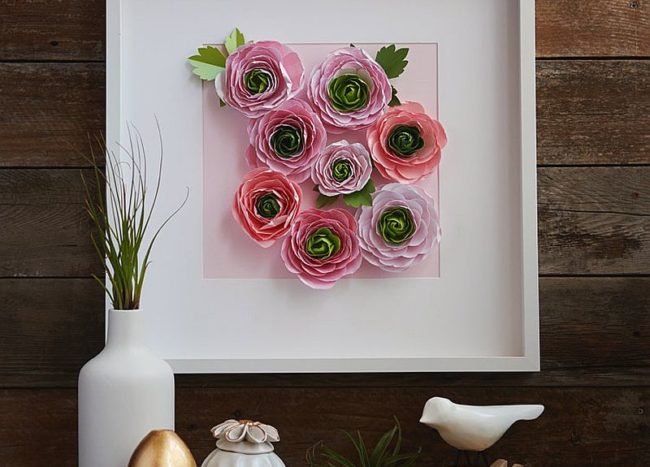
At what (x,y) coordinates should I click in order to perform the action: click on vase. Please return your answer as a coordinate pair (x, y). Looking at the image, I should click on (147, 407).